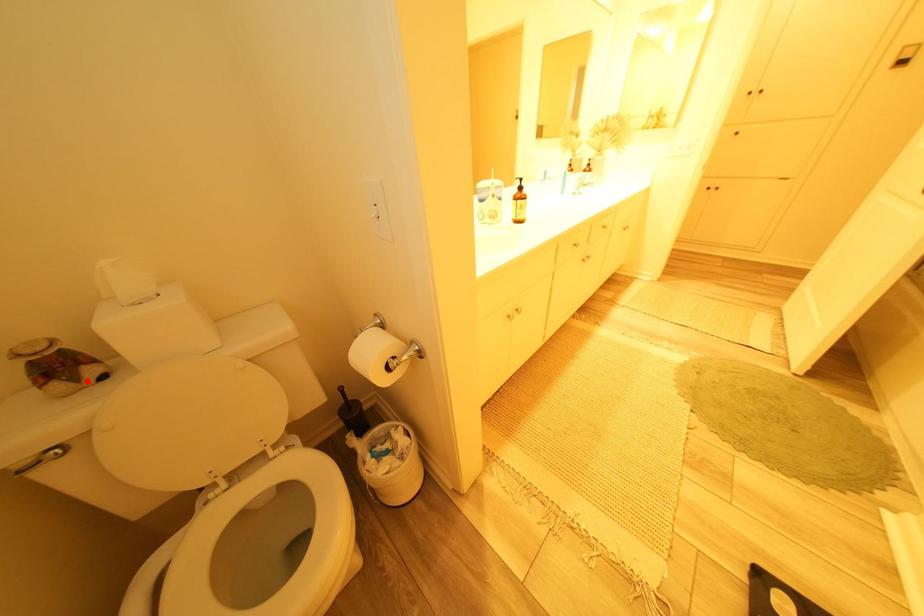
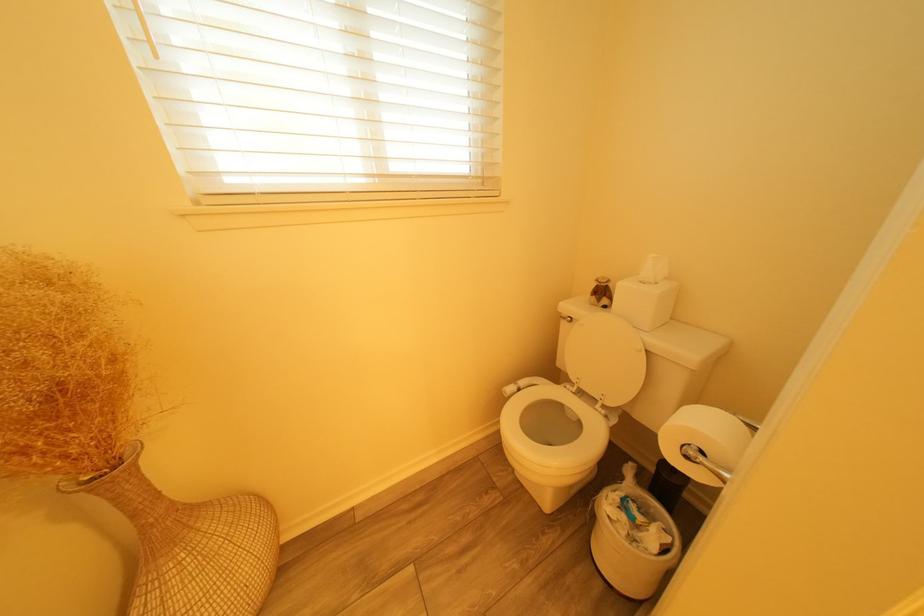
Locate, in the second image, the point that corresponds to the highlighted location in the first image.

(610, 302)